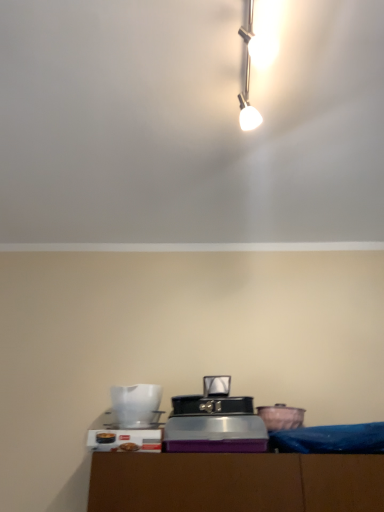
Question: In terms of height, does white glossy pitcher at lower left, arranged as the 2th appliance when viewed from the left, look taller or shorter compared to white plastic toaster at lower center, which appears as the 1th appliance when viewed from the left?

Choices:
 (A) short
 (B) tall

Answer: (B)

Question: Considering the positions of point (155, 394) and point (150, 422), is point (155, 394) closer or farther from the camera than point (150, 422)?

Choices:
 (A) closer
 (B) farther

Answer: (B)

Question: Estimate the real-world distances between objects in this image. Which object is closer to the white glossy pitcher at lower left, the second appliance from the right?

Choices:
 (A) matte pink ceramic bowl at lower right, acting as the 1th appliance starting from the right
 (B) white plastic toaster at lower center, which appears as the 1th appliance when viewed from the left

Answer: (B)

Question: Estimate the real-world distances between objects in this image. Which object is closer to the matte pink ceramic bowl at lower right, acting as the 1th appliance starting from the right?

Choices:
 (A) white glossy pitcher at lower left, the second appliance from the right
 (B) white plastic toaster at lower center, which appears as the 1th appliance when viewed from the left

Answer: (A)